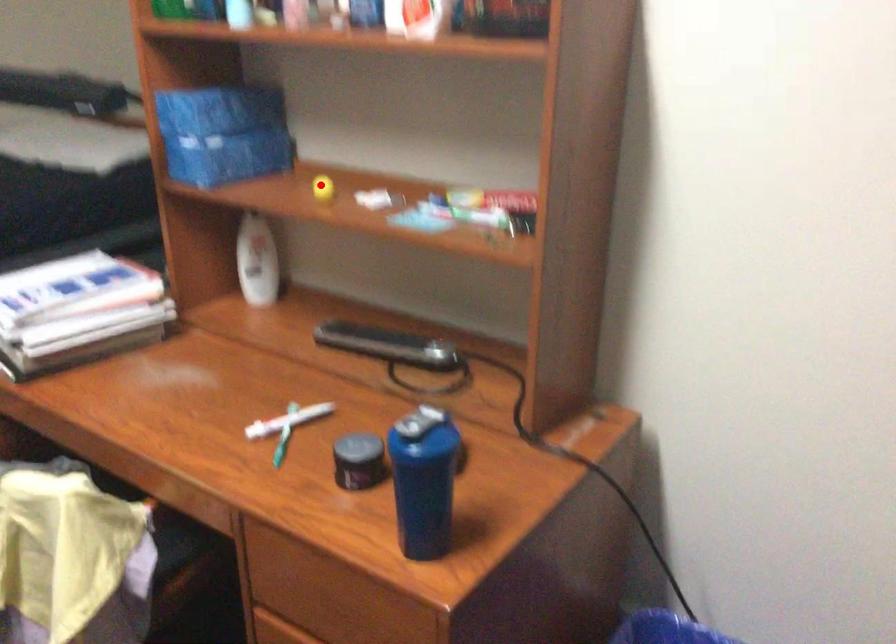
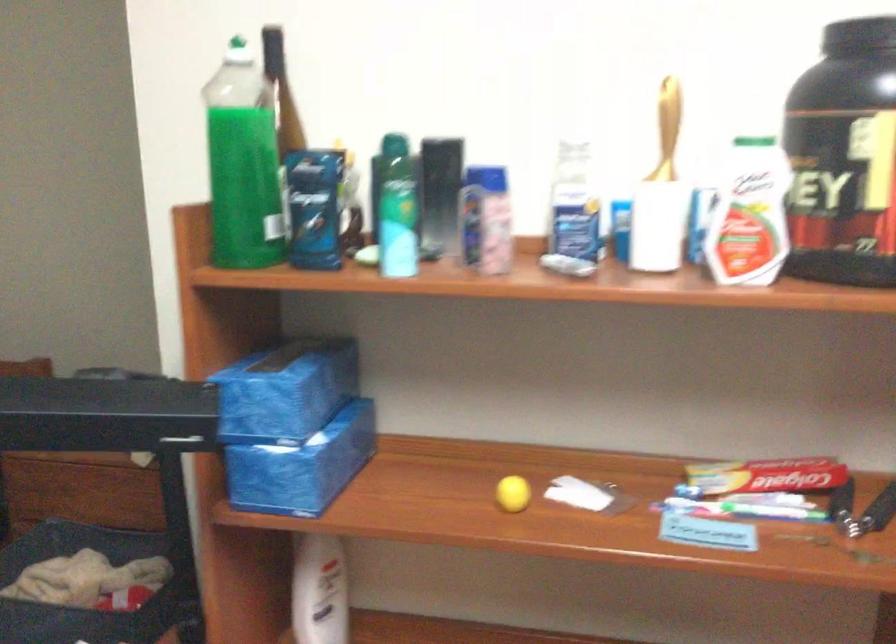
Question: I am providing you with two images of the same scene from different viewpoints. A red point is shown in image1. For the corresponding object point in image2, is it positioned nearer or farther from the camera?

Choices:
 (A) Nearer
 (B) Farther

Answer: (A)